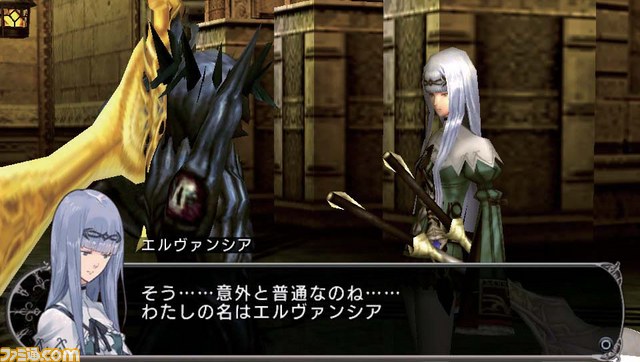
You are a GUI agent. You are given a task and a screenshot of the screen. Output one action in this format:
    pyautogui.click(x=<x>, y=<y>)
    Task: Click on the lantern cover
    The height and width of the screenshot is (362, 640).
    Given the screenshot: What is the action you would take?
    pyautogui.click(x=29, y=5)